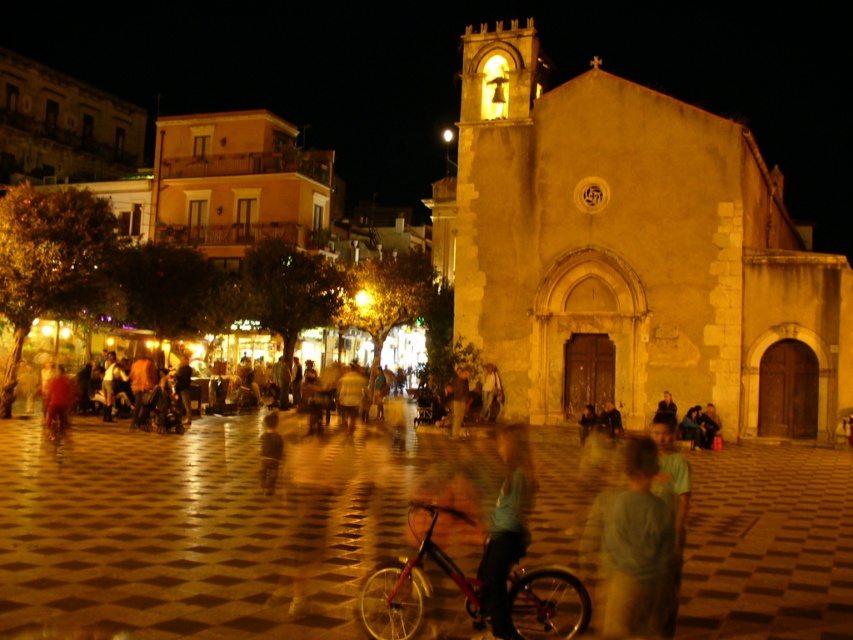
Question: Among these points, which one is farthest from the camera?

Choices:
 (A) (570, 618)
 (B) (819, 486)

Answer: (B)

Question: Which object appears farthest from the camera in this image?

Choices:
 (A) yellow stone church at center
 (B) light blue cotton shirt at center
 (C) light blue fabric shirt at center

Answer: (A)

Question: Is yellow stone church at center thinner than light blue cotton shirt at center?

Choices:
 (A) no
 (B) yes

Answer: (A)

Question: Among these objects, which one is nearest to the camera?

Choices:
 (A) shiny red bicycle at center
 (B) yellow stone church at center
 (C) matte stone pavement at center
 (D) light blue fabric shirt at center

Answer: (C)

Question: Where is yellow stone church at center located in relation to light blue fabric shirt at center in the image?

Choices:
 (A) above
 (B) below

Answer: (A)

Question: Can you confirm if yellow stone church at center is positioned to the left of light brown fabric shirt at center?

Choices:
 (A) yes
 (B) no

Answer: (B)